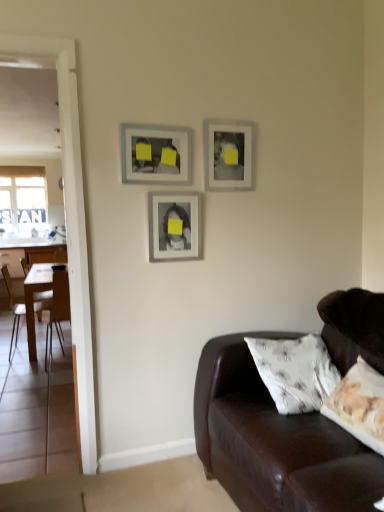
Question: Does matte gray picture frame at upper center, which ranks as the 3th picture frame in left-to-right order, contain transparent glass door at left?

Choices:
 (A) yes
 (B) no

Answer: (B)

Question: Is matte gray picture frame at upper center, which appears as the 1th picture frame when viewed from the right, looking in the opposite direction of transparent glass door at left?

Choices:
 (A) yes
 (B) no

Answer: (B)

Question: Is matte gray picture frame at upper center, which appears as the 1th picture frame when viewed from the right, beside transparent glass door at left?

Choices:
 (A) no
 (B) yes

Answer: (A)

Question: Considering the relative sizes of matte gray picture frame at upper center, which ranks as the 3th picture frame in left-to-right order, and transparent glass door at left in the image provided, is matte gray picture frame at upper center, which ranks as the 3th picture frame in left-to-right order, thinner than transparent glass door at left?

Choices:
 (A) yes
 (B) no

Answer: (A)

Question: Is matte gray picture frame at upper center, which appears as the 1th picture frame when viewed from the right, taller than transparent glass door at left?

Choices:
 (A) yes
 (B) no

Answer: (B)

Question: Considering the relative sizes of matte gray picture frame at upper center, which ranks as the 3th picture frame in left-to-right order, and transparent glass door at left in the image provided, is matte gray picture frame at upper center, which ranks as the 3th picture frame in left-to-right order, wider than transparent glass door at left?

Choices:
 (A) no
 (B) yes

Answer: (A)

Question: Is light brown wooden chair at left, the second chair viewed from the right, at the back of transparent glass window at left?

Choices:
 (A) no
 (B) yes

Answer: (A)

Question: Can you confirm if transparent glass window at left is taller than light brown wooden chair at left, the second chair viewed from the right?

Choices:
 (A) no
 (B) yes

Answer: (B)

Question: Can you confirm if transparent glass window at left is positioned to the left of light brown wooden chair at left, the second chair viewed from the right?

Choices:
 (A) no
 (B) yes

Answer: (B)

Question: Considering the relative sizes of transparent glass window at left and light brown wooden chair at left, the 1th chair in the left-to-right sequence, in the image provided, is transparent glass window at left bigger than light brown wooden chair at left, the 1th chair in the left-to-right sequence,?

Choices:
 (A) no
 (B) yes

Answer: (A)

Question: Does transparent glass window at left lie in front of light brown wooden chair at left, the second chair viewed from the right?

Choices:
 (A) no
 (B) yes

Answer: (A)

Question: Could you tell me if transparent glass window at left is turned towards light brown wooden chair at left, the 1th chair in the left-to-right sequence?

Choices:
 (A) no
 (B) yes

Answer: (B)

Question: Is matte silver picture frame at center, the second picture frame positioned from the right, facing away from wooden chair at left, placed as the first chair when sorted from right to left?

Choices:
 (A) no
 (B) yes

Answer: (B)